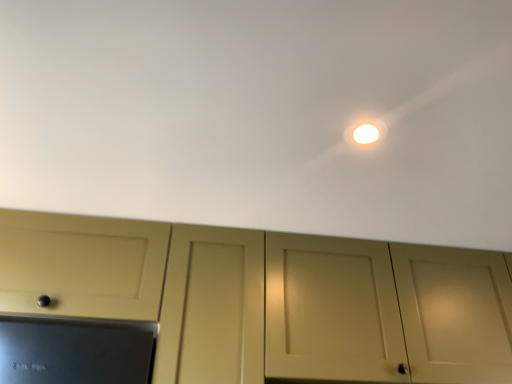
Question: From the image's perspective, is white matte ceiling at upper center above or below matte cream cabinet at center?

Choices:
 (A) above
 (B) below

Answer: (A)

Question: Is white matte ceiling at upper center inside or outside of matte cream cabinet at center?

Choices:
 (A) outside
 (B) inside

Answer: (A)

Question: Considering the real-world distances, which object is farthest from the white matte ceiling at upper center?

Choices:
 (A) white glossy light at upper center
 (B) matte cream cabinet at center

Answer: (B)

Question: Which is nearer to the white matte ceiling at upper center?

Choices:
 (A) white glossy light at upper center
 (B) matte cream cabinet at center

Answer: (A)